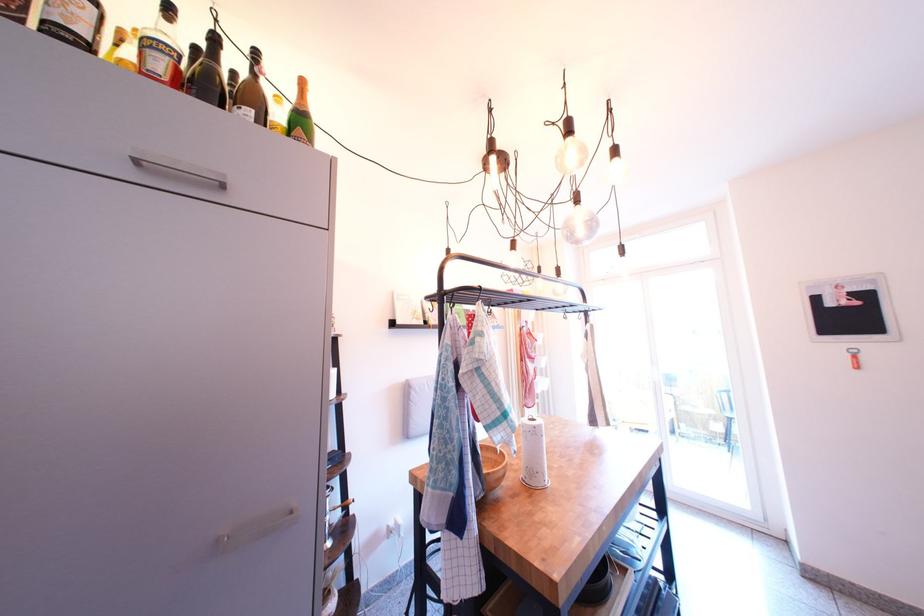
Describe the element at coordinates (256, 528) in the screenshot. Image resolution: width=924 pixels, height=616 pixels. I see `the lower cabinet handle` at that location.